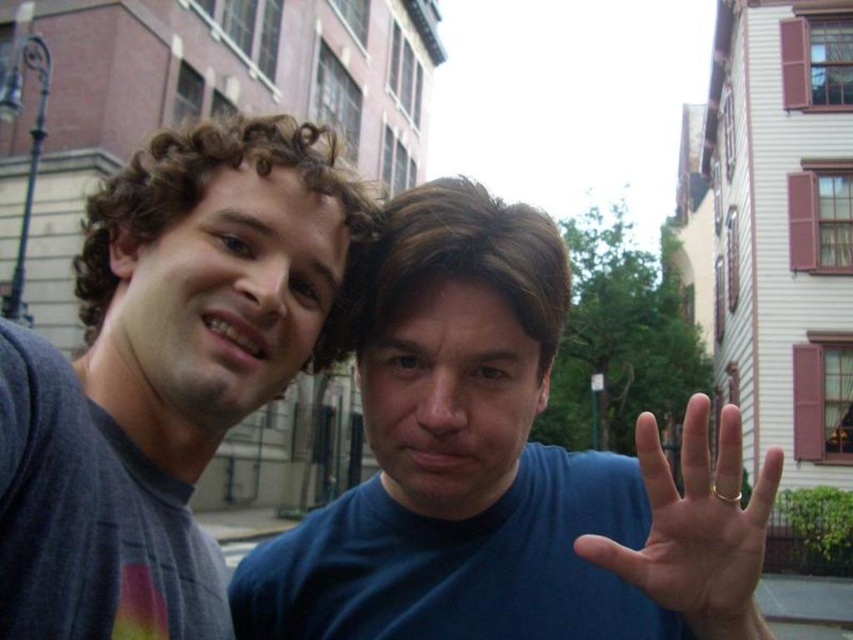
Question: Observing the image, what is the correct spatial positioning of blue matte shirt at center in reference to gray matte t-shirt at left?

Choices:
 (A) right
 (B) left

Answer: (A)

Question: Which point appears farthest from the camera in this image?

Choices:
 (A) (672, 536)
 (B) (280, 336)

Answer: (B)

Question: Which of the following is the farthest from the observer?

Choices:
 (A) (93, 492)
 (B) (535, 483)
 (C) (735, 493)

Answer: (B)

Question: Is blue matte shirt at center bigger than gold metallic ring at center?

Choices:
 (A) no
 (B) yes

Answer: (A)

Question: Is gray matte t-shirt at left smaller than gold metallic ring at center?

Choices:
 (A) no
 (B) yes

Answer: (B)

Question: Which of these objects is positioned closest to the gray matte t-shirt at left?

Choices:
 (A) blue matte shirt at center
 (B) gold metallic ring at center

Answer: (A)